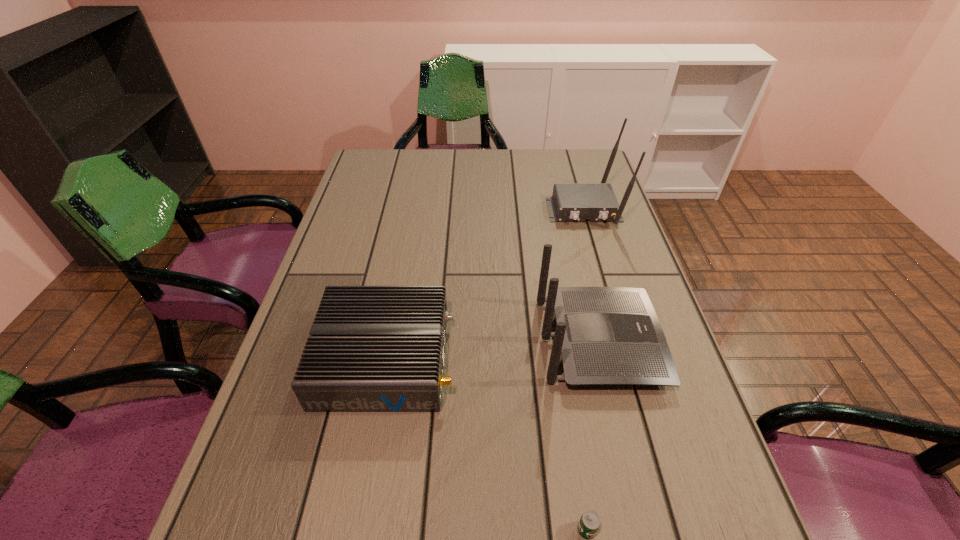
Where is `free spot at the right edge of the desktop`? The image size is (960, 540). free spot at the right edge of the desktop is located at coordinates (648, 466).

This screenshot has width=960, height=540. What are the coordinates of `vacant point at the far left corner` in the screenshot? It's located at click(370, 157).

The image size is (960, 540). What are the coordinates of `free point at the far right corner` in the screenshot? It's located at (568, 178).

The image size is (960, 540). I want to click on blank region between the leftmost router and the farthest router, so click(485, 284).

Locate an element on the screen. The image size is (960, 540). unoccupied position between the shortest router and the second tallest object is located at coordinates (492, 350).

The image size is (960, 540). I want to click on empty location between the second tallest router and the tallest router, so click(591, 275).

Where is `free spot between the leftmost router and the farthest router`? This screenshot has height=540, width=960. free spot between the leftmost router and the farthest router is located at coordinates (485, 284).

Where is `vacant region between the leftmost object and the third shortest object`? vacant region between the leftmost object and the third shortest object is located at coordinates (492, 350).

Choose which object is the second nearest neighbor to the farthest router. Please provide its 2D coordinates. Your answer should be formatted as a tuple, i.e. [(x, y)], where the tuple contains the x and y coordinates of a point satisfying the conditions above.

[(372, 348)]

The height and width of the screenshot is (540, 960). What are the coordinates of `the closest object relative to the nearest object` in the screenshot? It's located at (606, 335).